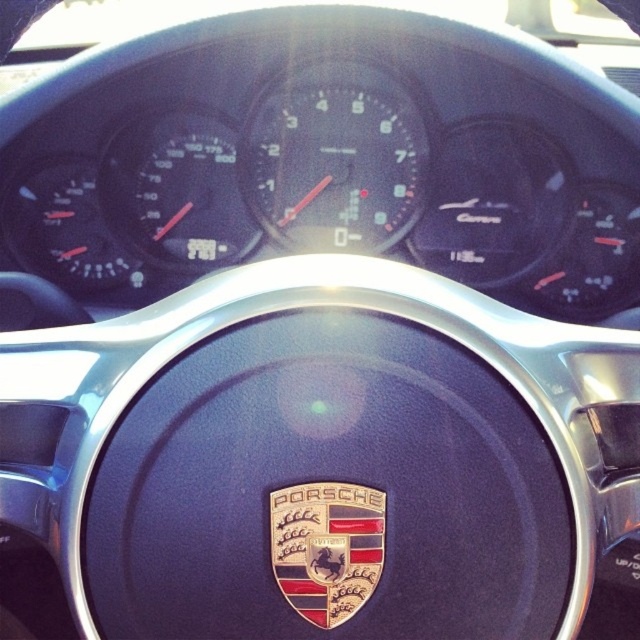
Question: Is matte black speedometer at center below gold metallic porsche emblem at center?

Choices:
 (A) no
 (B) yes

Answer: (A)

Question: Which of the following is the farthest from the observer?

Choices:
 (A) gold metallic porsche emblem at center
 (B) matte black speedometer at center

Answer: (B)

Question: Can you confirm if matte black speedometer at center is bigger than gold metallic porsche emblem at center?

Choices:
 (A) no
 (B) yes

Answer: (B)

Question: From the image, what is the correct spatial relationship of matte black speedometer at center in relation to gold metallic porsche emblem at center?

Choices:
 (A) below
 (B) above

Answer: (B)

Question: Which of the following is the closest to the observer?

Choices:
 (A) matte black speedometer at center
 (B) gold metallic porsche emblem at center

Answer: (B)